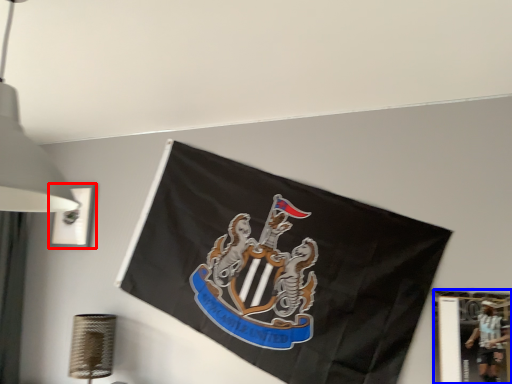
Question: Which point is closer to the camera, picture frame (highlighted by a red box) or picture frame (highlighted by a blue box)?

Choices:
 (A) picture frame
 (B) picture frame

Answer: (B)